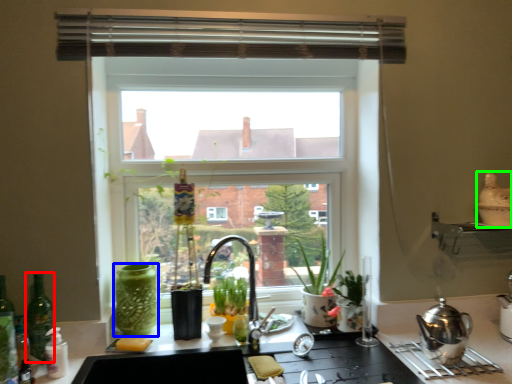
Question: Estimate the real-world distances between objects in this image. Which object is farther from bottle (highlighted by a red box), glass vase (highlighted by a blue box) or appliance (highlighted by a green box)?

Choices:
 (A) glass vase
 (B) appliance

Answer: (B)